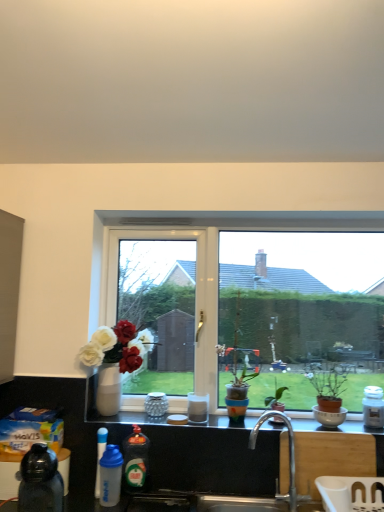
I want to click on vacant area that is in front of green matte plant at center, acting as the second houseplant starting from the left, so click(x=278, y=429).